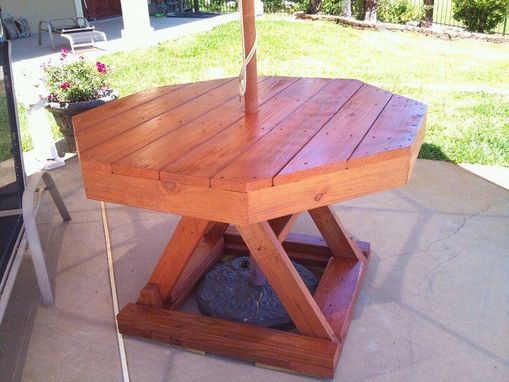
This screenshot has width=509, height=382. I want to click on lounger chair, so click(x=91, y=27).